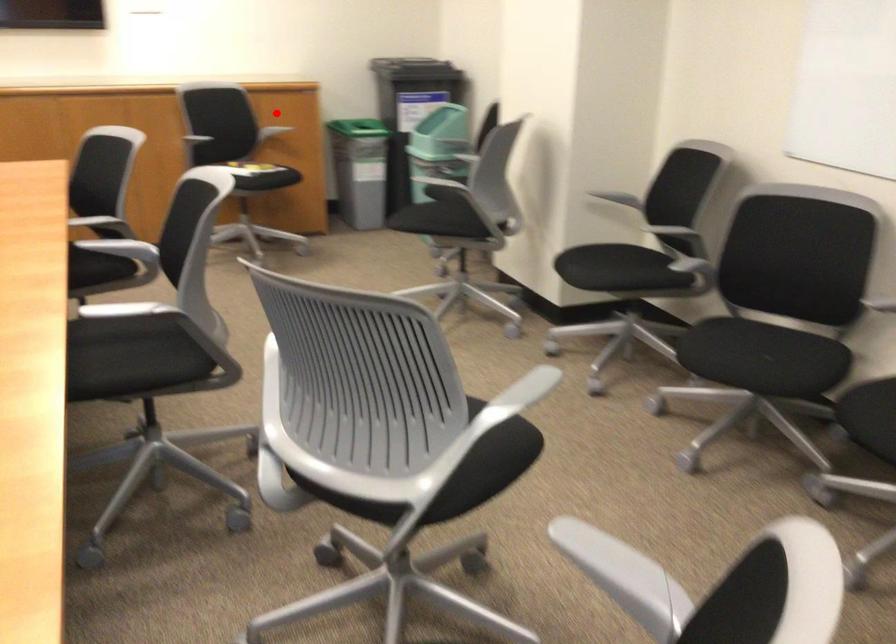
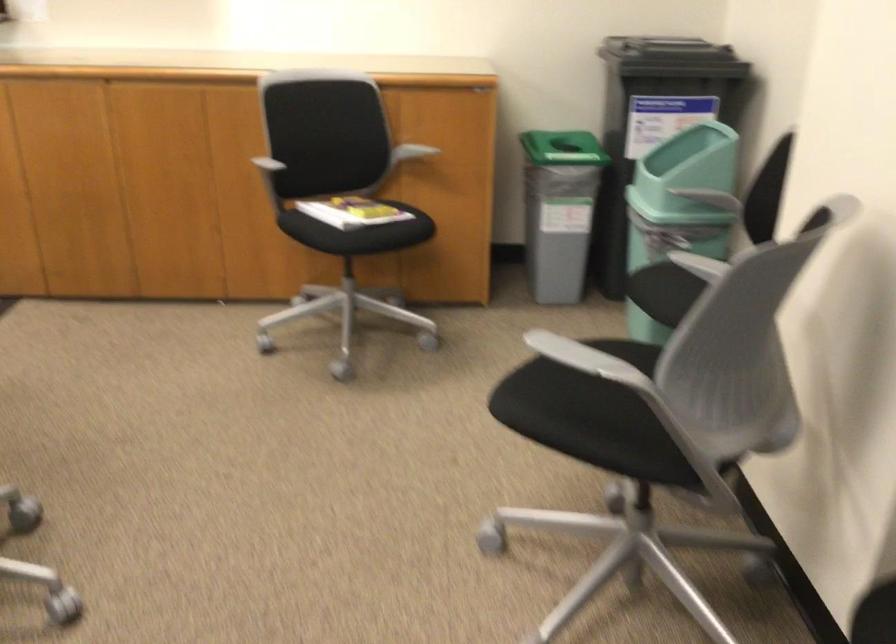
Where in the second image is the point corresponding to the highlighted location from the first image?

(409, 152)